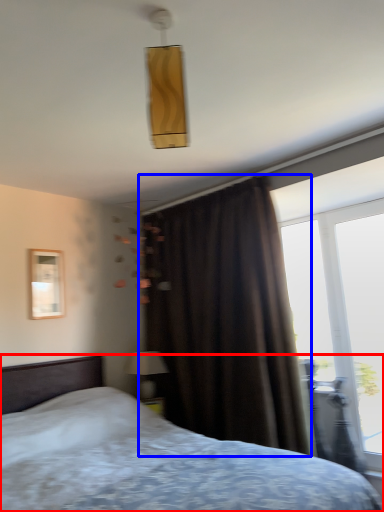
Question: Among these objects, which one is nearest to the camera, bed (highlighted by a red box) or curtain (highlighted by a blue box)?

Choices:
 (A) bed
 (B) curtain

Answer: (A)